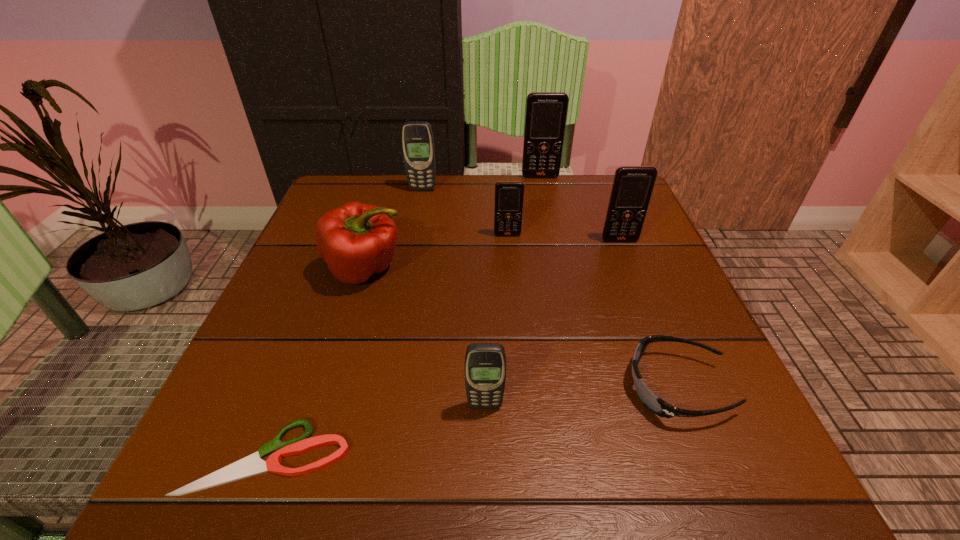
The width and height of the screenshot is (960, 540). I want to click on free space located 0.050m on the screen of the nearer gray cellular telephone, so click(485, 440).

Locate an element on the screen. free region located on the lenses of the sunglasses is located at coordinates (455, 387).

Locate an element on the screen. This screenshot has width=960, height=540. vacant region located on the lenses of the sunglasses is located at coordinates (545, 387).

Identify the location of vacant space located on the lenses of the sunglasses. (481, 387).

The width and height of the screenshot is (960, 540). In order to click on free space located on the back of the shortest object in this screenshot , I will do click(x=341, y=262).

Where is `object at the near edge`? This screenshot has width=960, height=540. object at the near edge is located at coordinates (252, 465).

Where is `bell pepper present at the left edge`? The image size is (960, 540). bell pepper present at the left edge is located at coordinates (356, 240).

The width and height of the screenshot is (960, 540). Find the location of `scissors at the left edge`. scissors at the left edge is located at coordinates (252, 465).

This screenshot has height=540, width=960. I want to click on cellular telephone that is at the right edge, so click(632, 187).

At what (x,y) coordinates should I click in order to perform the action: click on sunglasses that is positioned at the right edge. Please return your answer as a coordinate pair (x, y). The image size is (960, 540). Looking at the image, I should click on (655, 404).